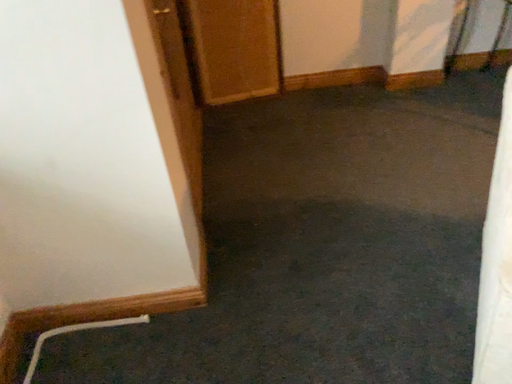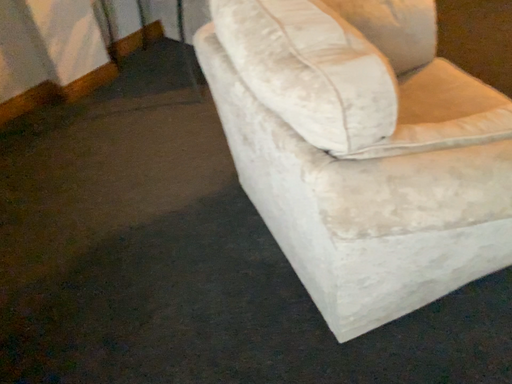
Question: How did the camera likely rotate when shooting the video?

Choices:
 (A) rotated downward
 (B) rotated upward

Answer: (B)